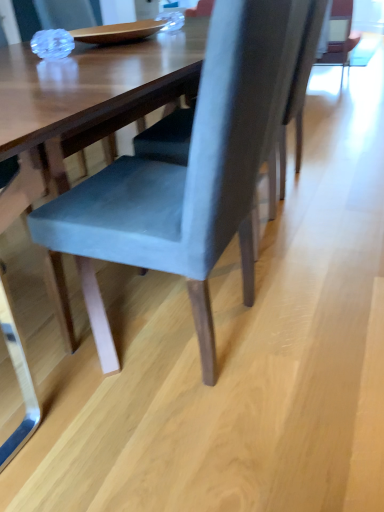
The width and height of the screenshot is (384, 512). I want to click on free region on the left part of velvet blue chair at center, the 2th chair from the back, so click(40, 352).